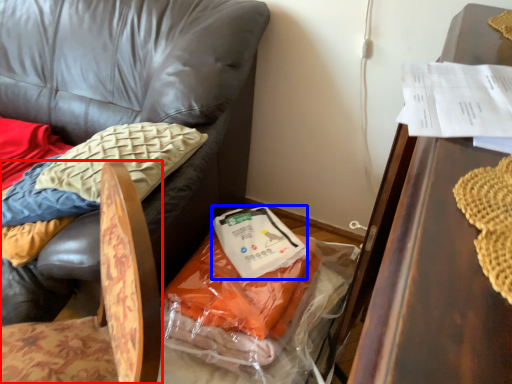
Question: Which object appears farthest to the camera in this image, chair (highlighted by a red box) or food (highlighted by a blue box)?

Choices:
 (A) chair
 (B) food

Answer: (B)